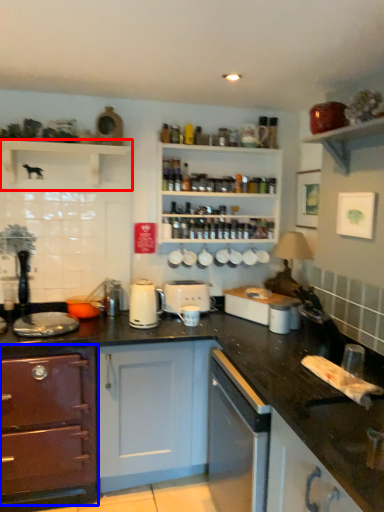
Question: Among these objects, which one is farthest to the camera, shelf (highlighted by a red box) or cabinetry (highlighted by a blue box)?

Choices:
 (A) shelf
 (B) cabinetry

Answer: (A)